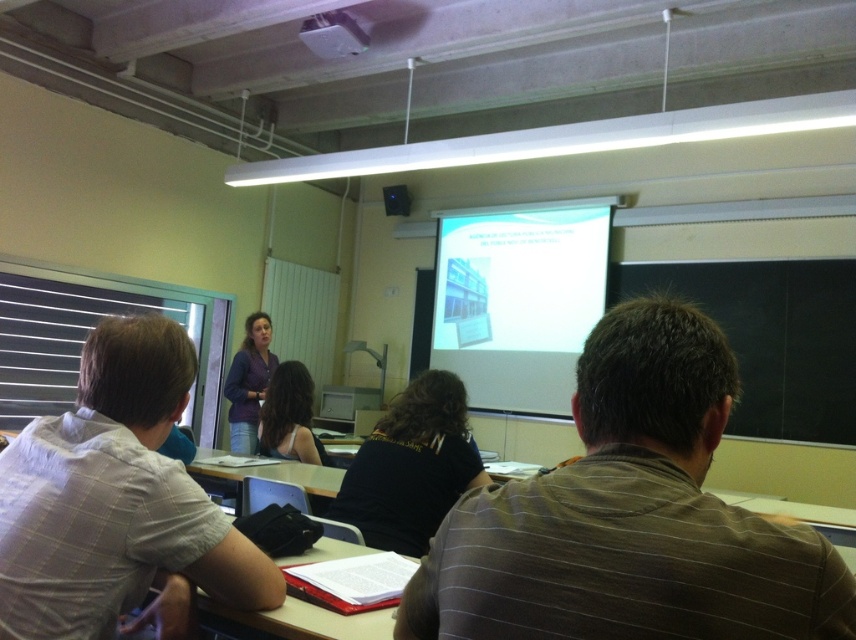
From the picture: In the classroom scene, there is a student wearing a brown striped shirt at center and a white matte projection screen at upper center. From the perspective of someone sitting at the front of the room, which object is positioned to the left?

The brown striped shirt at center is to the left of the white matte projection screen at upper center, so from the front row perspective, the brown striped shirt at center is on the left side.

You are a photographer in the classroom and want to take a photo of both the brown striped shirt at center and the blue fabric shirt at center. To ensure both shirts are in the frame, should you position your camera to the left or the right of the shirts?

The brown striped shirt at center is to the right of the blue fabric shirt at center. To capture both shirts in the frame, position the camera to the left of the shirts so that the brown striped shirt at center and blue fabric shirt at center are both visible.

You are a student sitting in the classroom and want to determine the relative positions of two points marked on the projector screen. Which point is closer to you, point at coordinates (520, 305) or point at coordinates (306, 618)?

Point at coordinates (520, 305) is further to the viewer than point at coordinates (306, 618), so the point closer to you is point at coordinates (306, 618).